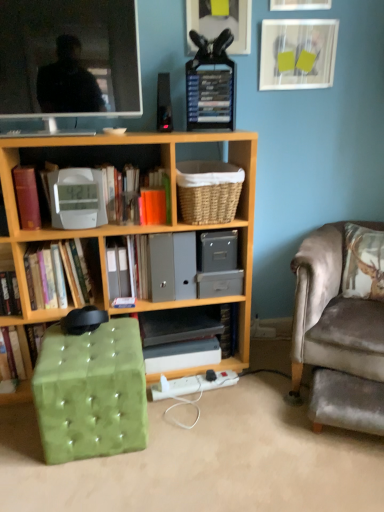
The height and width of the screenshot is (512, 384). I want to click on free area in between white plastic charger at lower center and velvet green footrest at lower right, so click(254, 403).